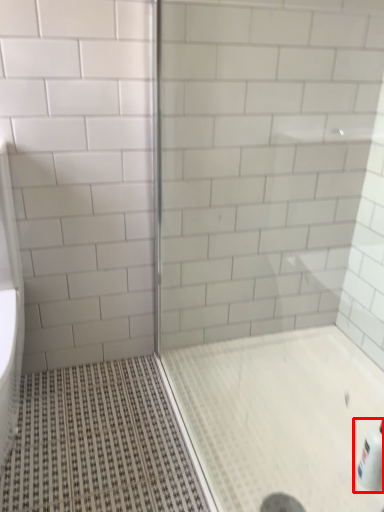
Question: From the image, what is the correct spatial relationship of bottle (annotated by the red box) in relation to screen door?

Choices:
 (A) right
 (B) left

Answer: (A)